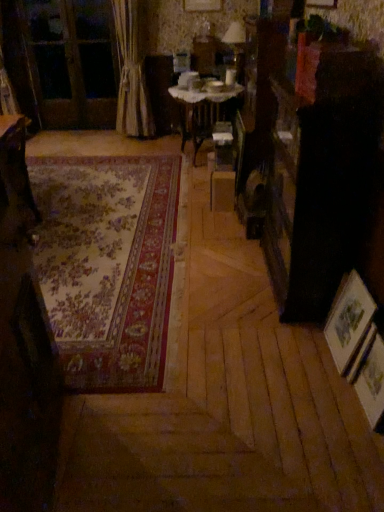
The image size is (384, 512). I want to click on free space to the left of wooden picture frame at lower right, the 2th picture frame from the front, so click(304, 353).